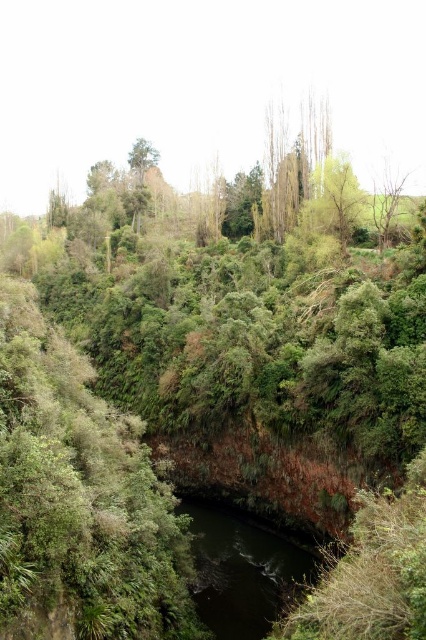
Question: Which point appears closest to the camera in this image?

Choices:
 (A) (134, 152)
 (B) (317, 557)

Answer: (B)

Question: Is dark green water at center to the left of green matte tree at upper center from the viewer's perspective?

Choices:
 (A) yes
 (B) no

Answer: (B)

Question: From the image, what is the correct spatial relationship of dark green water at center in relation to green matte tree at upper center?

Choices:
 (A) above
 (B) below

Answer: (B)

Question: Does dark green water at center appear over green matte tree at upper center?

Choices:
 (A) yes
 (B) no

Answer: (B)

Question: Which of the following is the farthest from the observer?

Choices:
 (A) dark green water at center
 (B) green matte tree at upper center

Answer: (B)